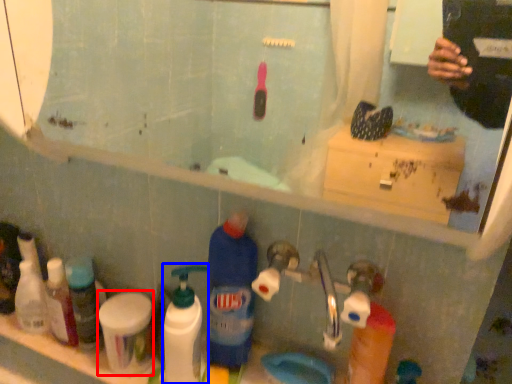
Question: Which object appears closest to the camera in this image, mouthwash (highlighted by a red box) or cleaning product (highlighted by a blue box)?

Choices:
 (A) mouthwash
 (B) cleaning product

Answer: (B)